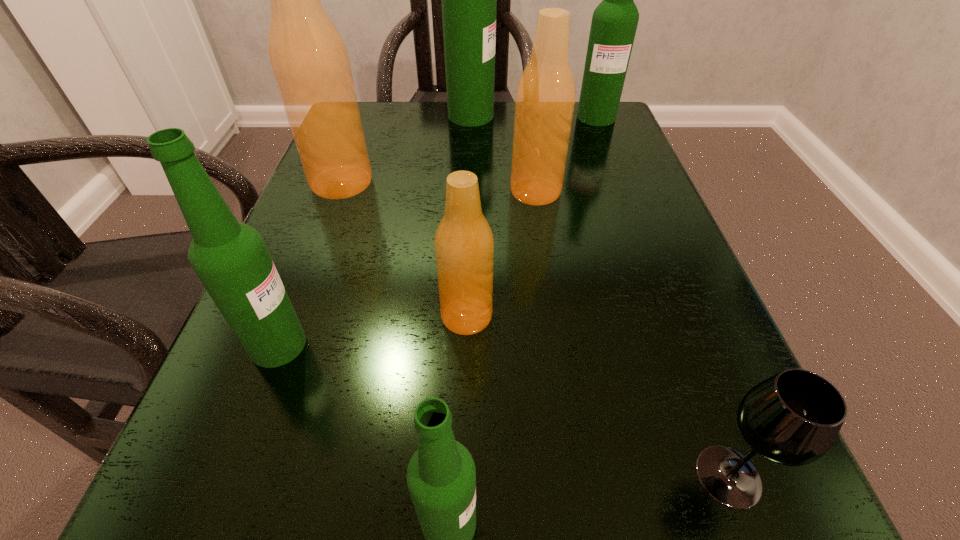
Where is `vacant space at the near right corner`? vacant space at the near right corner is located at coordinates (719, 513).

Locate an element on the screen. The width and height of the screenshot is (960, 540). vacant space that is in between the shortest object and the leftmost tan beer bottle is located at coordinates (536, 329).

This screenshot has width=960, height=540. In order to click on vacant area that lies between the wineglass and the nearest tan beer bottle in this screenshot , I will do `click(598, 396)`.

At what (x,y) coordinates should I click in order to perform the action: click on free space between the biggest tan beer bottle and the nearest tan beer bottle. Please return your answer as a coordinate pair (x, y). Image resolution: width=960 pixels, height=540 pixels. Looking at the image, I should click on (404, 249).

Locate an element on the screen. This screenshot has height=540, width=960. vacant space that is in between the shortest object and the nearest tan beer bottle is located at coordinates (598, 396).

The height and width of the screenshot is (540, 960). Find the location of `free space between the gray wineglass and the rightmost tan beer bottle`. free space between the gray wineglass and the rightmost tan beer bottle is located at coordinates (632, 334).

Identify the location of free space that is in between the second tan beer bottle from left to right and the third object from right to left. The width and height of the screenshot is (960, 540). (501, 254).

The width and height of the screenshot is (960, 540). Find the location of `vacant space that's between the sixth object from left to right and the gray wineglass`. vacant space that's between the sixth object from left to right and the gray wineglass is located at coordinates (632, 334).

Locate an element on the screen. The width and height of the screenshot is (960, 540). vacant point located between the third smallest green beer bottle and the wineglass is located at coordinates (662, 296).

Locate an element on the screen. The height and width of the screenshot is (540, 960). object that ranks as the fourth closest to the smallest green beer bottle is located at coordinates (545, 97).